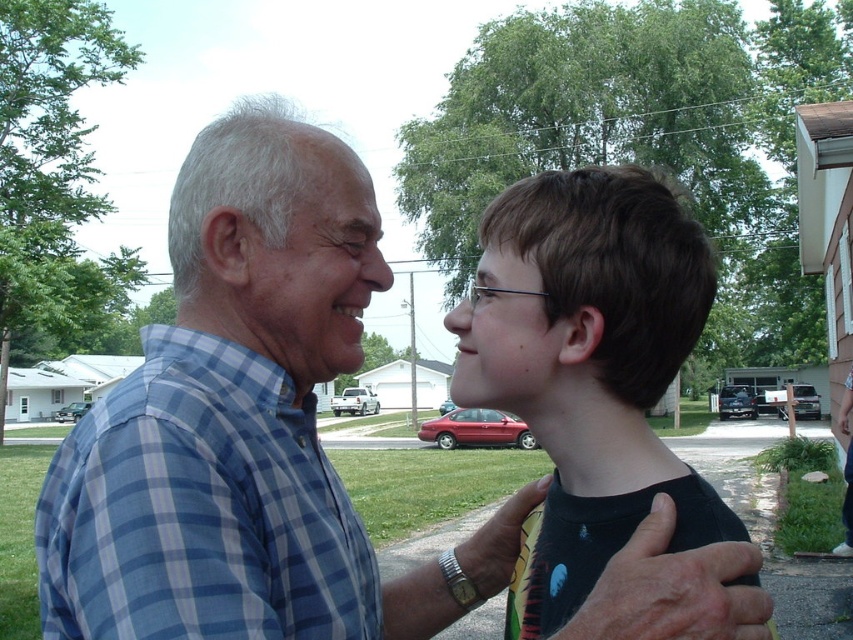
You are a photographer trying to capture a candid shot of both the blue plaid shirt at center and the blue plaid shirt at left. Which one should you focus on first if you want to ensure both are in frame?

The blue plaid shirt at left should be focused on first since the blue plaid shirt at center is bigger and might block the smaller one if not positioned correctly.

You are a photographer trying to capture the older man and the younger boy in the scene. The blue plaid shirt at center and the black matte shirt at center are both visible. Which shirt is lower in the image?

The blue plaid shirt at center is positioned under the black matte shirt at center, so the blue plaid shirt at center is lower in the image.

Looking at this image, you are standing in the scene and want to greet the person wearing the blue plaid shirt at left. Which direction should you walk to reach them from the black matte shirt at center?

The blue plaid shirt at left is to the left of the black matte shirt at center, so you should walk to the left to reach them.